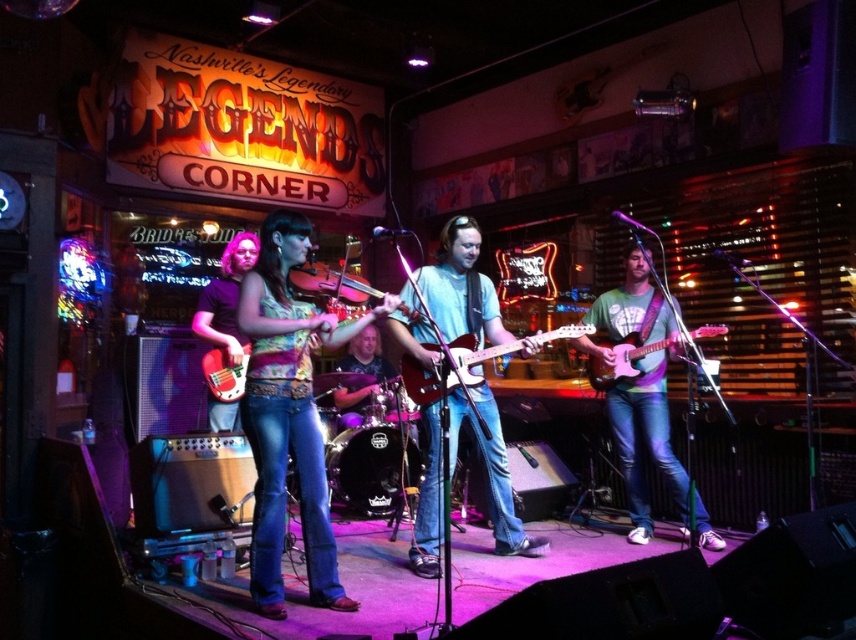
Does green matte guitar at center have a greater width compared to brushed metal guitar at center?

Yes, green matte guitar at center is wider than brushed metal guitar at center.

You are a GUI agent. You are given a task and a screenshot of the screen. Output one action in this format:
    pyautogui.click(x=<x>, y=<y>)
    Task: Click on the green matte guitar at center
    
    Given the screenshot: What is the action you would take?
    pyautogui.click(x=642, y=388)

Which is behind, point (648, 410) or point (229, 422)?

Point (229, 422)

You are a GUI agent. You are given a task and a screenshot of the screen. Output one action in this format:
    pyautogui.click(x=<x>, y=<y>)
    Task: Click on the green matte guitar at center
    This screenshot has height=640, width=856.
    Given the screenshot: What is the action you would take?
    pyautogui.click(x=642, y=388)

Who is positioned more to the right, shiny purple drum set at center or pink glossy electric guitar at right?

From the viewer's perspective, pink glossy electric guitar at right appears more on the right side.

Which is in front, point (363, 333) or point (718, 324)?

Positioned in front is point (718, 324).

Which is in front, point (342, 417) or point (603, 371)?

Positioned in front is point (603, 371).

Locate an element on the screen. This screenshot has width=856, height=640. shiny purple drum set at center is located at coordinates (360, 372).

Can you confirm if wooden acoustic guitar at center is shorter than glossy wood electric guitar at center?

No.

This screenshot has height=640, width=856. What do you see at coordinates (449, 298) in the screenshot?
I see `wooden acoustic guitar at center` at bounding box center [449, 298].

The image size is (856, 640). I want to click on wooden acoustic guitar at center, so click(449, 298).